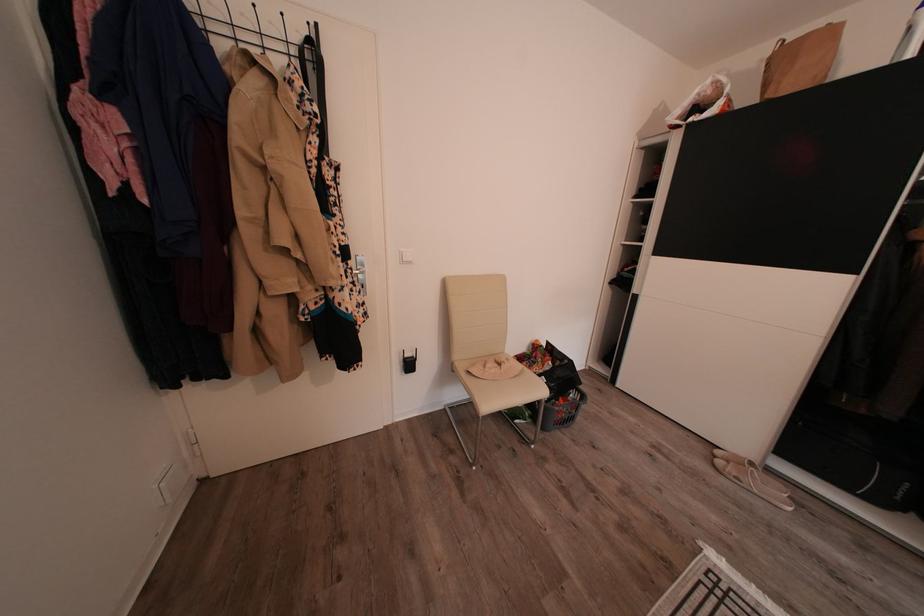
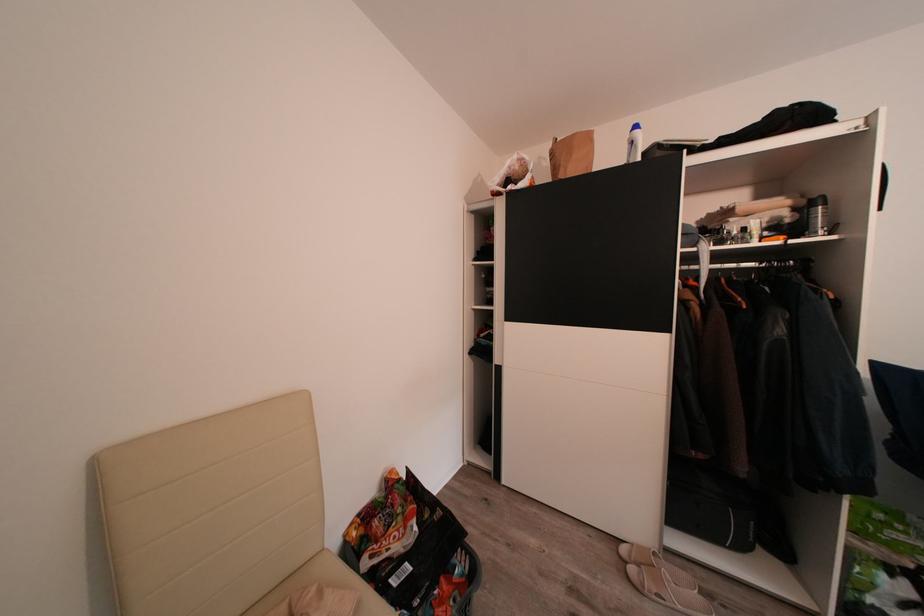
Where in the second image is the point corresponding to (x=565, y=405) from the first image?

(446, 589)